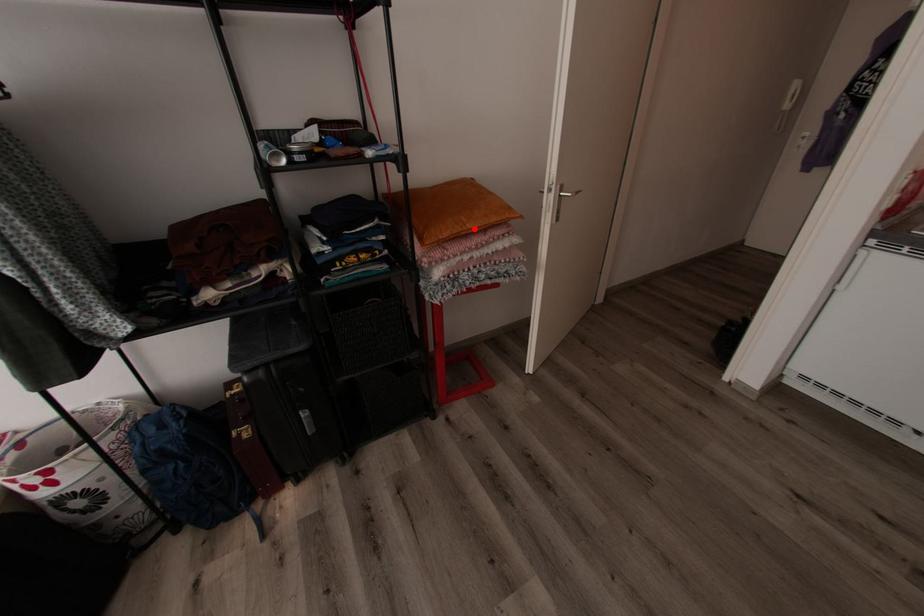
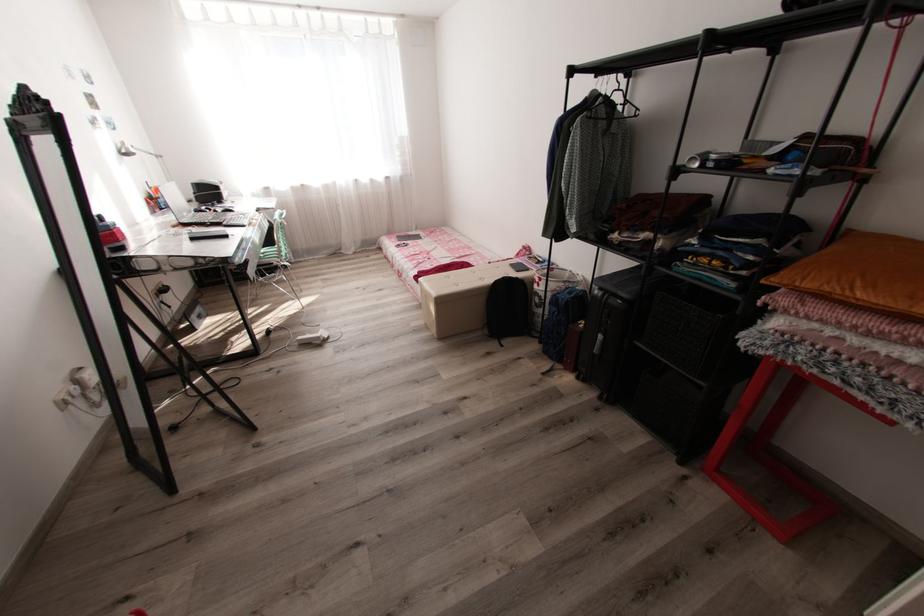
Question: A red point is marked in image1. In image2, is the corresponding 3D point closer to the camera or farther? Reply with the corresponding letter.

Choices:
 (A) The corresponding 3D point is closer.
 (B) The corresponding 3D point is farther.

Answer: (B)